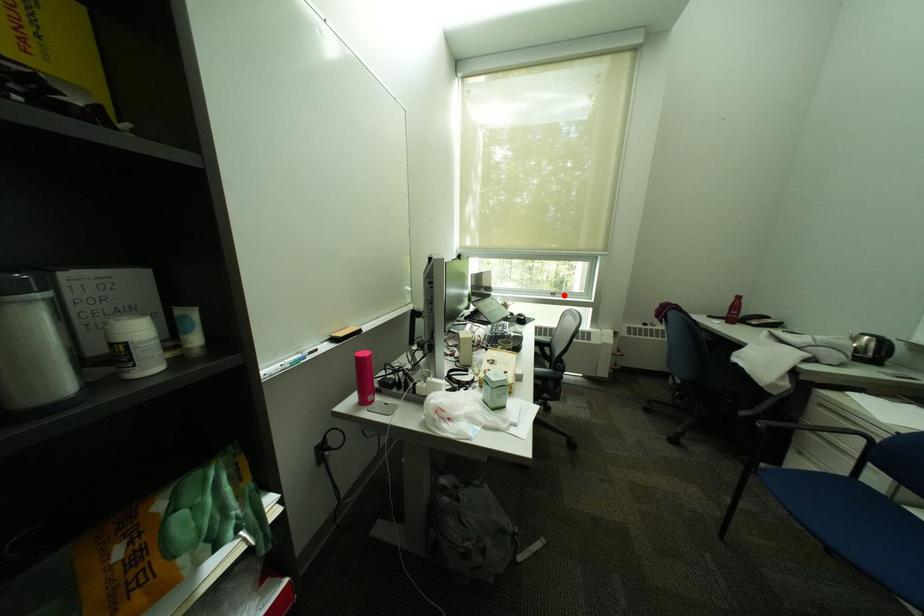
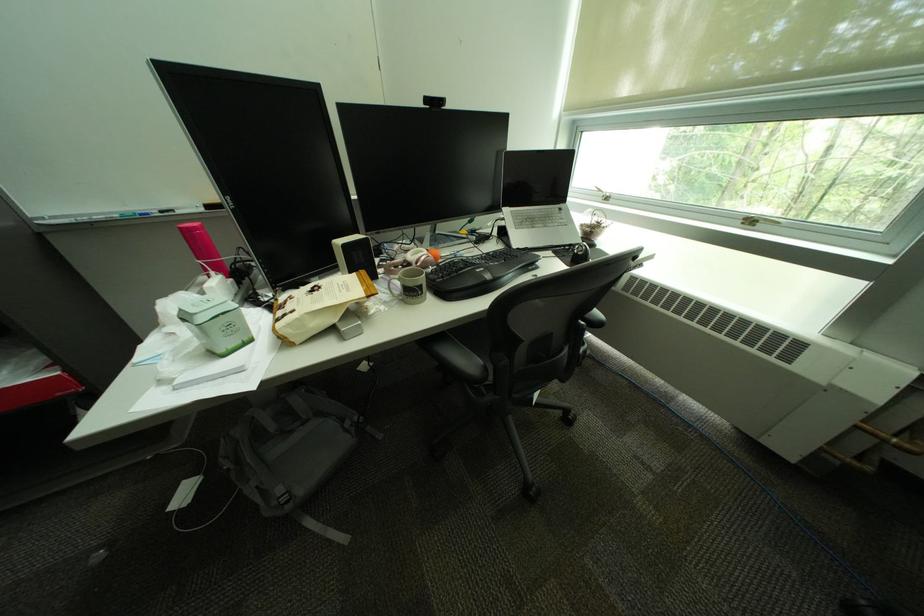
Where in the second image is the point corresponding to the highlighted location from the first image?

(761, 224)